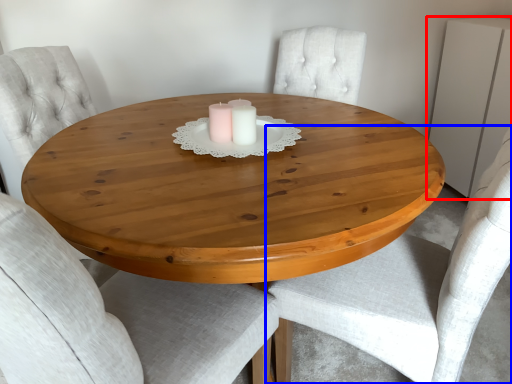
Question: Which point is closer to the camera, dresser (highlighted by a red box) or chair (highlighted by a blue box)?

Choices:
 (A) dresser
 (B) chair

Answer: (B)